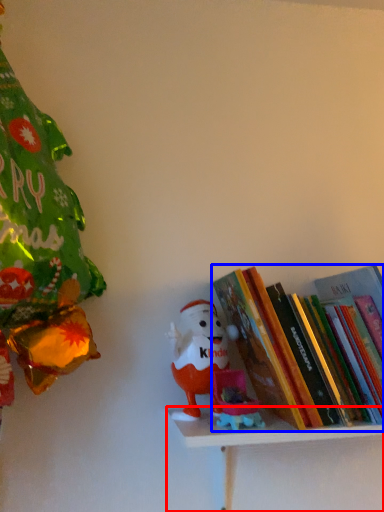
Question: Which point is further to the camera, shelf (highlighted by a red box) or book (highlighted by a blue box)?

Choices:
 (A) shelf
 (B) book

Answer: (B)